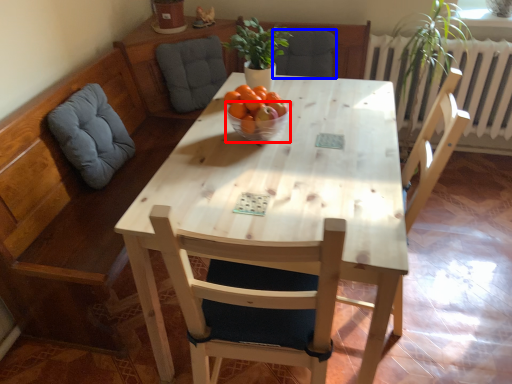
Question: Which point is further to the camera, glass bowl (highlighted by a red box) or armchair (highlighted by a blue box)?

Choices:
 (A) glass bowl
 (B) armchair

Answer: (B)